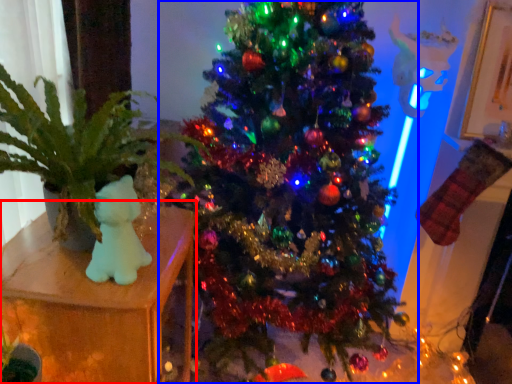
Question: Which of the following is the farthest to the observer, furniture (highlighted by a red box) or christmas tree (highlighted by a blue box)?

Choices:
 (A) furniture
 (B) christmas tree

Answer: (A)